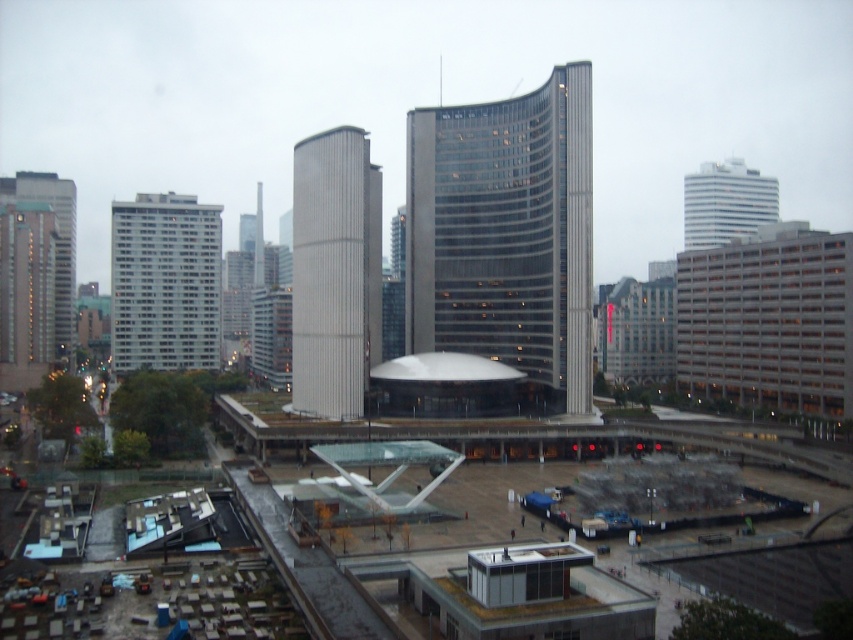
You are a city planner assessing the skyline. Which object, the glassy steel tower at center or the concrete construction site at lower left, has a greater height?

The glassy steel tower at center is taller than the concrete construction site at lower left.

You are a city planner reviewing a blueprint of the city. You notice a point labeled at coordinates (334, 273). Based on the image, what architectural feature does this point represent?

The point at coordinates (334, 273) corresponds to the smooth gray tower at center.